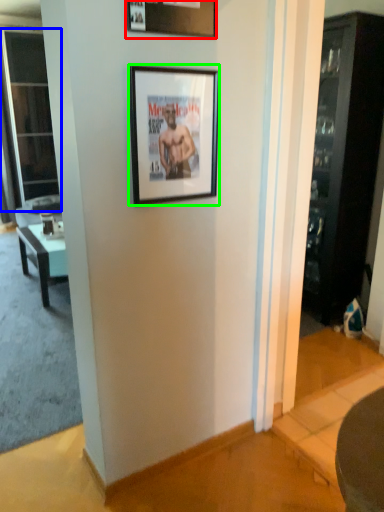
Question: Estimate the real-world distances between objects in this image. Which object is closer to picture frame (highlighted by a red box), screen door (highlighted by a blue box) or picture frame (highlighted by a green box)?

Choices:
 (A) screen door
 (B) picture frame

Answer: (B)